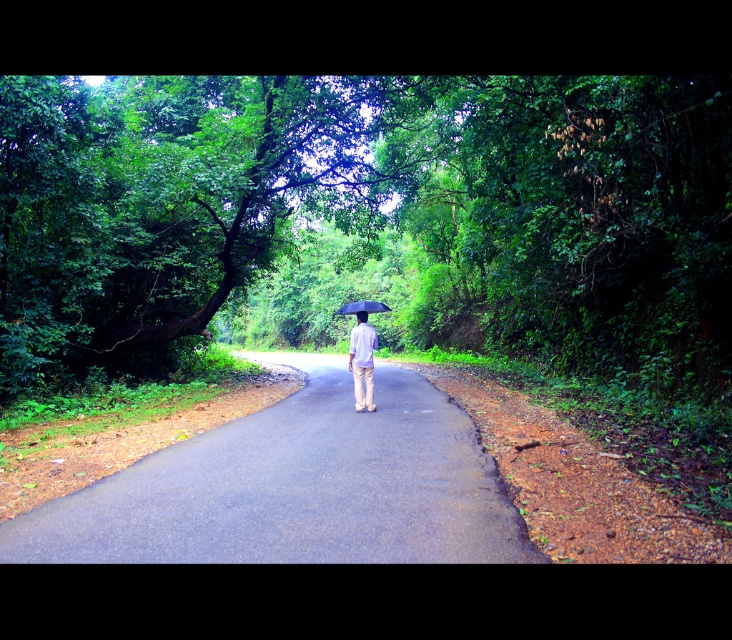
Looking at this image, can you confirm if asphalt road at center is positioned above light purple fabric umbrella at center?

Actually, asphalt road at center is below light purple fabric umbrella at center.

Which is below, asphalt road at center or light purple fabric umbrella at center?

Positioned lower is asphalt road at center.

Looking at this image, who is more forward, (283, 468) or (373, 333)?

Point (283, 468) is more forward.

At what (x,y) coordinates should I click in order to perform the action: click on asphalt road at center. Please return your answer as a coordinate pair (x, y). The image size is (732, 640). Looking at the image, I should click on (296, 486).

Which is behind, point (168, 540) or point (370, 304)?

Point (370, 304)

Is asphalt road at center behind black matte umbrella at center?

That is False.

Locate an element on the screen. This screenshot has width=732, height=640. asphalt road at center is located at coordinates (296, 486).

Identify the location of asphalt road at center. (296, 486).

Which is below, light purple fabric umbrella at center or black matte umbrella at center?

light purple fabric umbrella at center is lower down.

Can you confirm if light purple fabric umbrella at center is wider than black matte umbrella at center?

Incorrect, light purple fabric umbrella at center's width does not surpass black matte umbrella at center's.

Is point (359, 401) less distant than point (366, 314)?

Yes, it is.

This screenshot has height=640, width=732. What are the coordinates of `light purple fabric umbrella at center` in the screenshot? It's located at (362, 362).